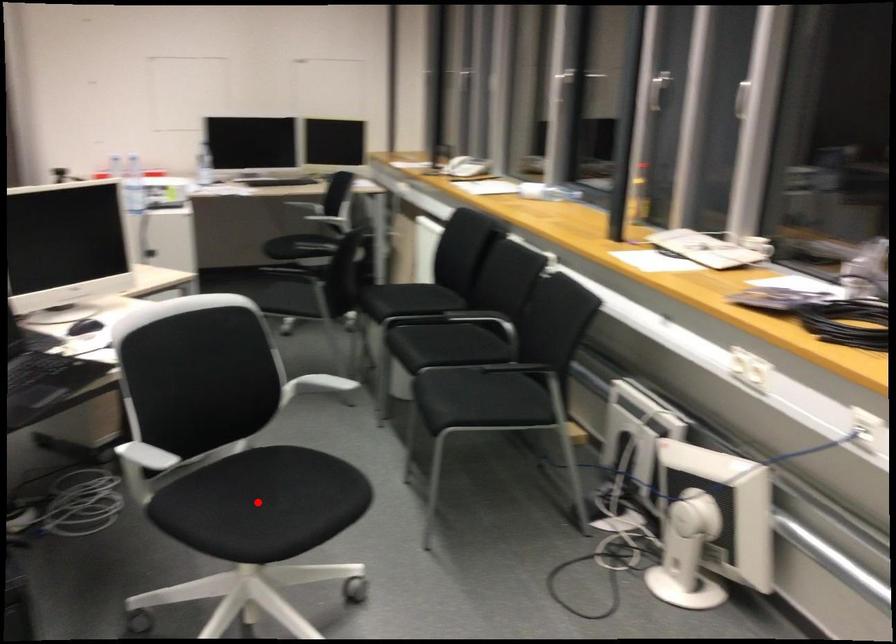
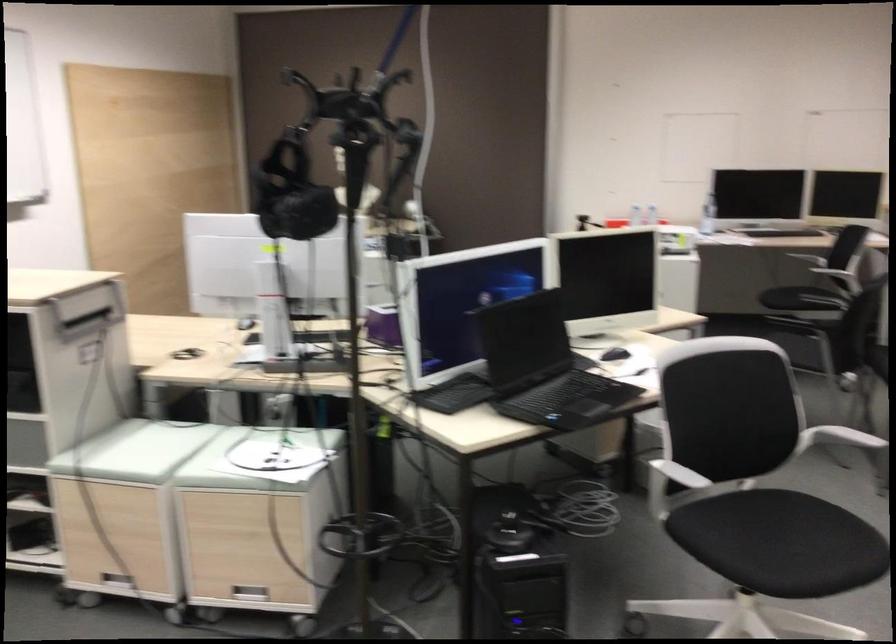
Locate, in the second image, the point that corresponds to the highlighted location in the first image.

(780, 542)